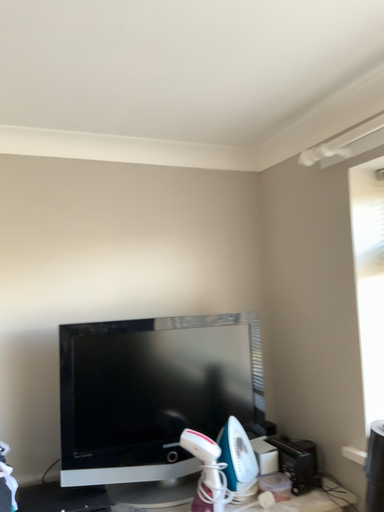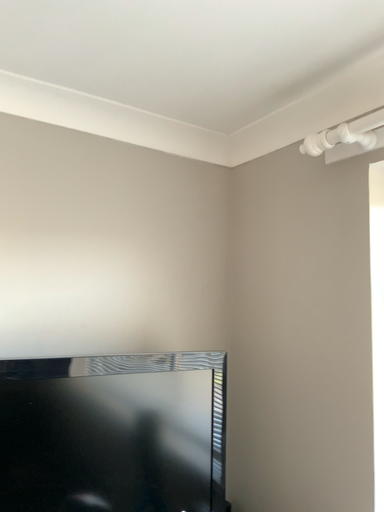
Question: Which way did the camera rotate in the video?

Choices:
 (A) rotated left
 (B) rotated right

Answer: (B)